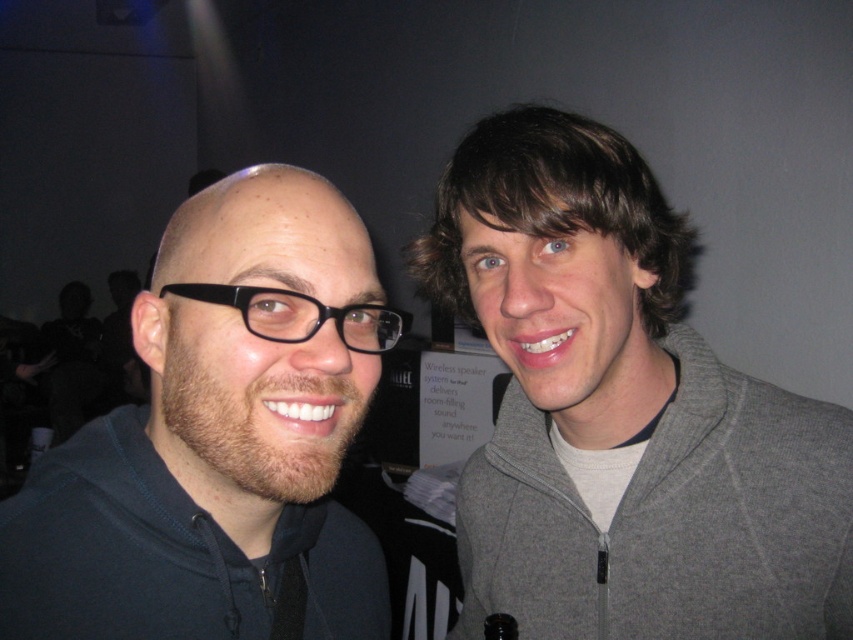
Question: Which object appears farthest from the camera in this image?

Choices:
 (A) matte black hoodie at left
 (B) black plastic glasses at center
 (C) gray fleece jacket at right

Answer: (C)

Question: Does matte black hoodie at left have a larger size compared to black plastic glasses at center?

Choices:
 (A) no
 (B) yes

Answer: (B)

Question: Where is gray fleece jacket at right located in relation to black plastic glasses at center in the image?

Choices:
 (A) left
 (B) right

Answer: (B)

Question: Among these points, which one is nearest to the camera?

Choices:
 (A) (374, 339)
 (B) (717, 636)
 (C) (293, 426)

Answer: (C)

Question: Where is matte black hoodie at left located in relation to black plastic glasses at center in the image?

Choices:
 (A) below
 (B) above

Answer: (A)

Question: Considering the real-world distances, which object is closest to the gray fleece jacket at right?

Choices:
 (A) black plastic glasses at center
 (B) matte black hoodie at left

Answer: (B)